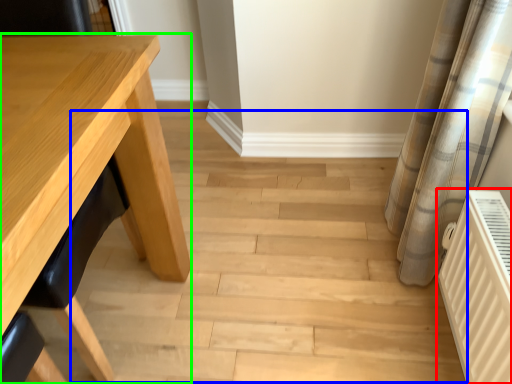
Question: Estimate the real-world distances between objects in this image. Which object is farther from radiator (highlighted by a red box), stair (highlighted by a blue box) or table (highlighted by a green box)?

Choices:
 (A) stair
 (B) table

Answer: (B)